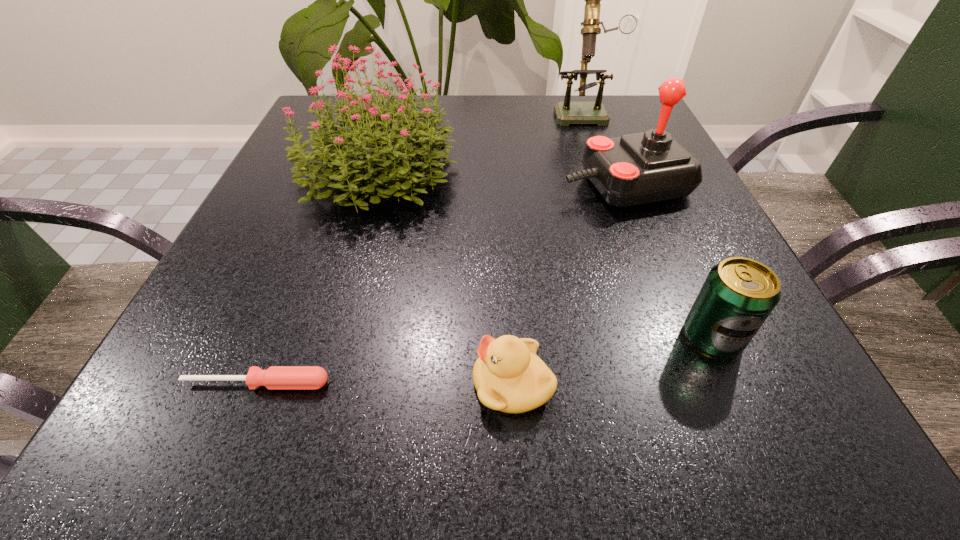
What are the coordinates of `microscope` in the screenshot? It's located at (567, 112).

You are a GUI agent. You are given a task and a screenshot of the screen. Output one action in this format:
    pyautogui.click(x=<x>, y=<y>)
    Task: Click on the farthest object
    The width and height of the screenshot is (960, 540).
    Given the screenshot: What is the action you would take?
    pyautogui.click(x=567, y=112)

Image resolution: width=960 pixels, height=540 pixels. What are the coordinates of `the fifth shortest object` in the screenshot? It's located at (402, 154).

Locate an element on the screen. The width and height of the screenshot is (960, 540). the fourth shortest object is located at coordinates (641, 168).

The image size is (960, 540). What are the coordinates of `the third shortest object` in the screenshot? It's located at (738, 295).

Locate an element on the screen. duckling is located at coordinates (508, 376).

You are a GUI agent. You are given a task and a screenshot of the screen. Output one action in this format:
    pyautogui.click(x=<x>, y=<y>)
    Task: Click on the second shortest object
    
    Given the screenshot: What is the action you would take?
    pyautogui.click(x=508, y=376)

This screenshot has width=960, height=540. Identify the location of the shortest object. (275, 377).

Locate an element on the screen. vacant space situated 0.350m at the eyepiece of the farthest object is located at coordinates (622, 219).

You are a GUI agent. You are given a task and a screenshot of the screen. Output one action in this format:
    pyautogui.click(x=<x>, y=<y>)
    Task: Click on the free location located 0.220m on the front of the fifth shortest object
    The height and width of the screenshot is (540, 960).
    Given the screenshot: What is the action you would take?
    pyautogui.click(x=333, y=319)